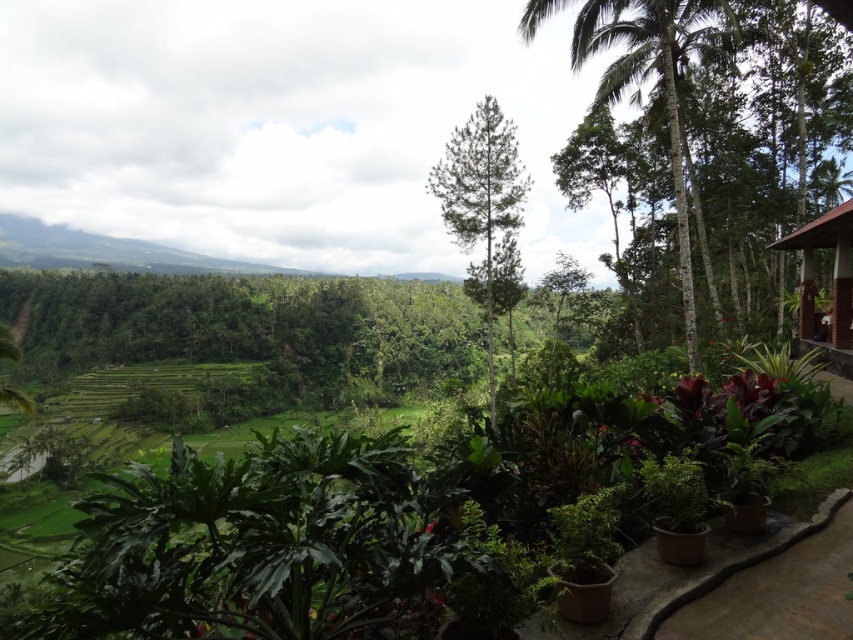
Can you confirm if brown concrete path at lower right is taller than brown wooden hut at right?

Incorrect, brown concrete path at lower right's height is not larger of brown wooden hut at right's.

This screenshot has width=853, height=640. What do you see at coordinates (775, 588) in the screenshot? I see `brown concrete path at lower right` at bounding box center [775, 588].

Between point (839, 589) and point (848, 220), which one is positioned behind?

The point (848, 220) is behind.

The height and width of the screenshot is (640, 853). I want to click on brown concrete path at lower right, so click(x=775, y=588).

Does brown concrete path at lower right appear on the right side of green textured palm tree at upper right?

Incorrect, brown concrete path at lower right is not on the right side of green textured palm tree at upper right.

Is brown concrete path at lower right behind green textured palm tree at upper right?

No.

Between point (757, 556) and point (675, 188), which one is positioned in front?

Point (757, 556)

Where is `brown concrete path at lower right`? brown concrete path at lower right is located at coordinates [x=775, y=588].

Does green textured palm tree at upper right lie behind brown wooden hut at right?

That is True.

Between point (683, 220) and point (845, 220), which one is positioned in front?

Positioned in front is point (845, 220).

Identify the location of green textured palm tree at upper right. The width and height of the screenshot is (853, 640). (660, 81).